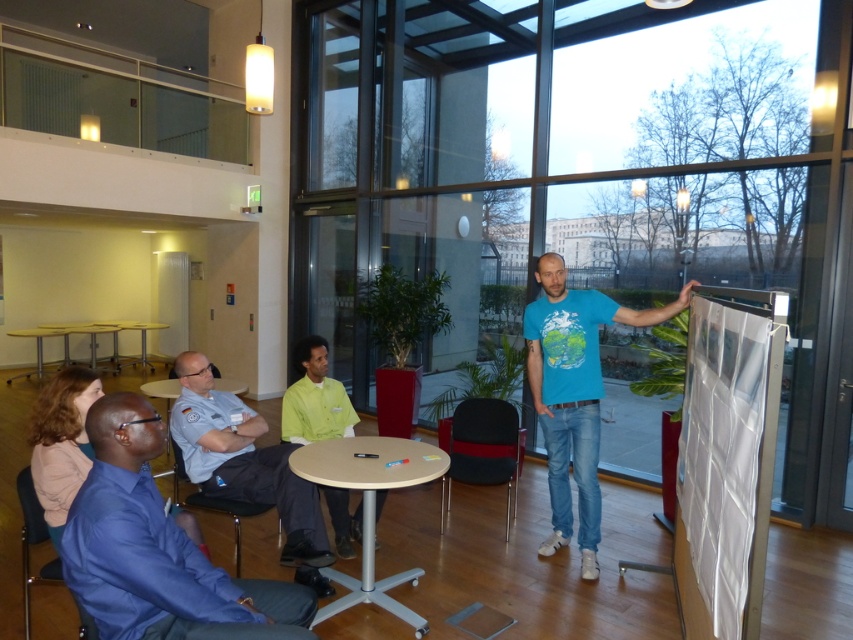
From the picture: You are attending a meeting in this room and need to decide whether to sit at the matte metal table at lower left or stand near the light blue uniform at center. Considering the space available, which location allows for more personal space?

The matte metal table at lower left is larger than the light blue uniform at center, so sitting at the matte metal table at lower left would provide more personal space.